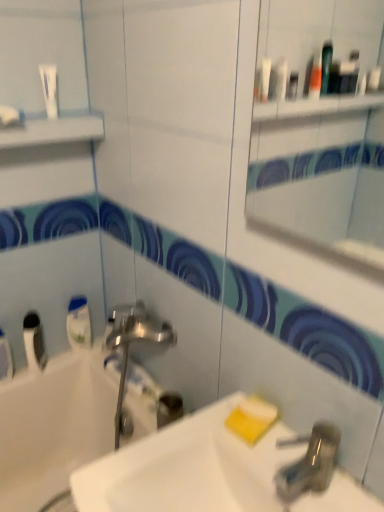
The image size is (384, 512). I want to click on vacant region in front of yellow sponge at lower center, which ranks as the 1th soap in bottom-to-top order, so click(276, 466).